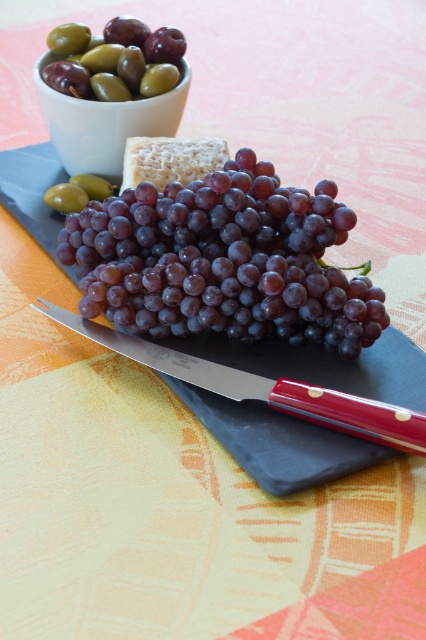
Can you confirm if shiny purple grapes at center is positioned to the left of polished red handle knife at center?

No, shiny purple grapes at center is not to the left of polished red handle knife at center.

Where is `shiny purple grapes at center`? Image resolution: width=426 pixels, height=640 pixels. shiny purple grapes at center is located at coordinates (222, 260).

Does polished red handle knife at center have a lesser width compared to white matte bowl at upper left?

Incorrect, polished red handle knife at center's width is not less than white matte bowl at upper left's.

Is polished red handle knife at center positioned at the back of white matte bowl at upper left?

No, it is in front of white matte bowl at upper left.

What do you see at coordinates (264, 387) in the screenshot? This screenshot has width=426, height=640. I see `polished red handle knife at center` at bounding box center [264, 387].

This screenshot has width=426, height=640. I want to click on polished red handle knife at center, so click(x=264, y=387).

Does point (288, 305) lie in front of point (88, 141)?

That is True.

Between point (161, 196) and point (63, 93), which one is positioned behind?

The point (63, 93) is more distant.

Find the location of a particular element. shiny purple grapes at center is located at coordinates (222, 260).